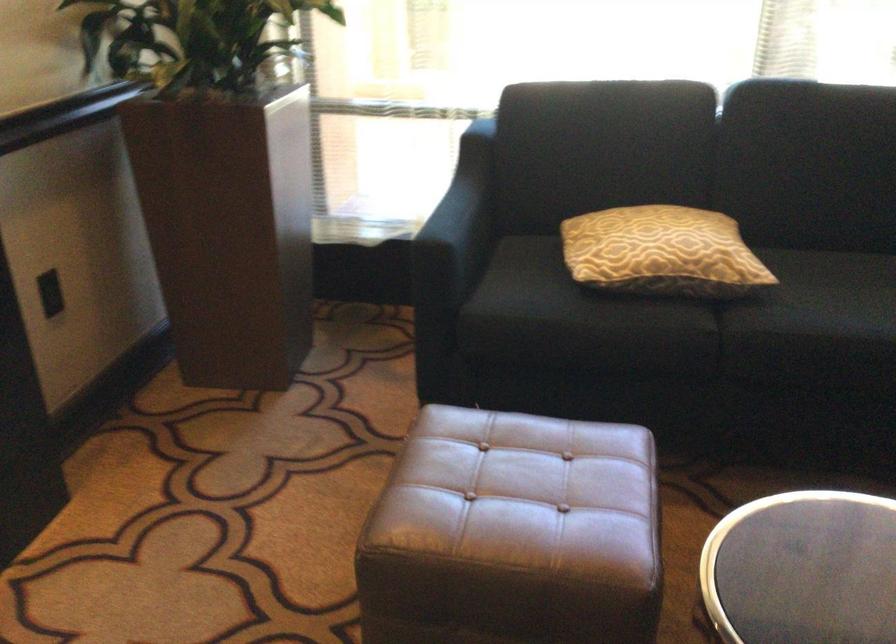
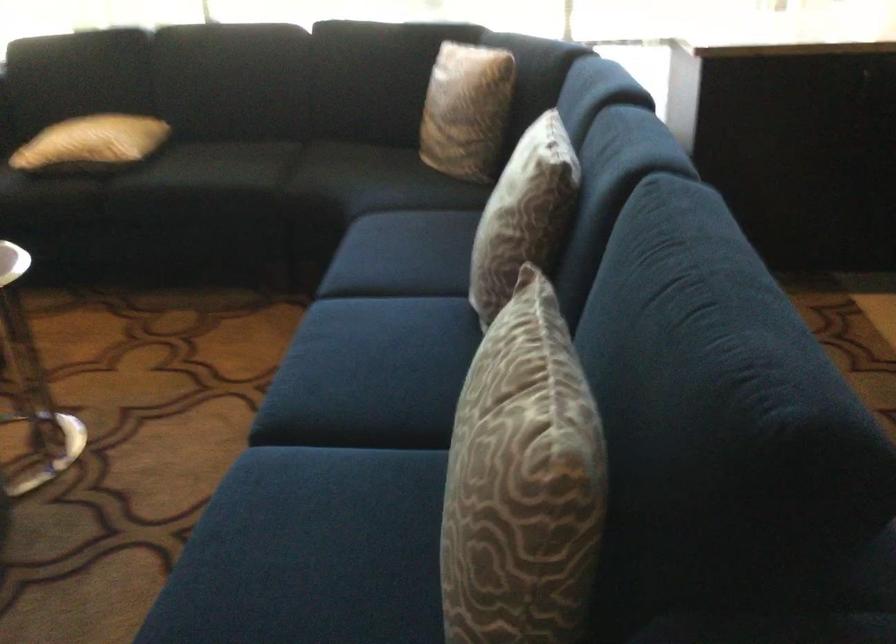
The point at (624, 135) is marked in the first image. Where is the corresponding point in the second image?

(82, 64)